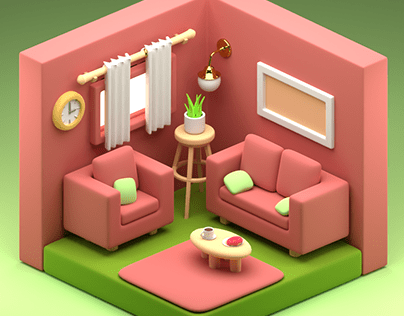
The width and height of the screenshot is (404, 316). In order to click on corner in this screenshot , I will do `click(207, 2)`.